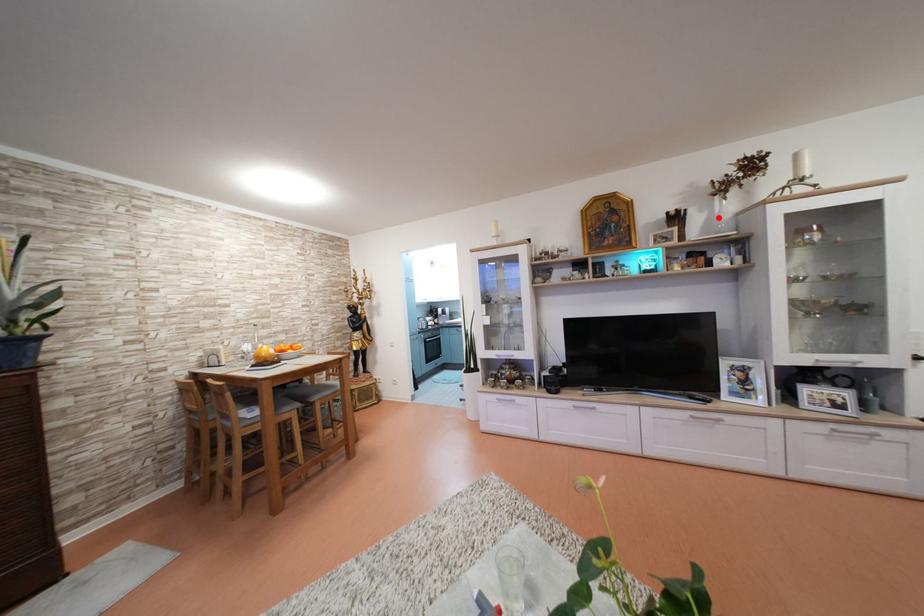
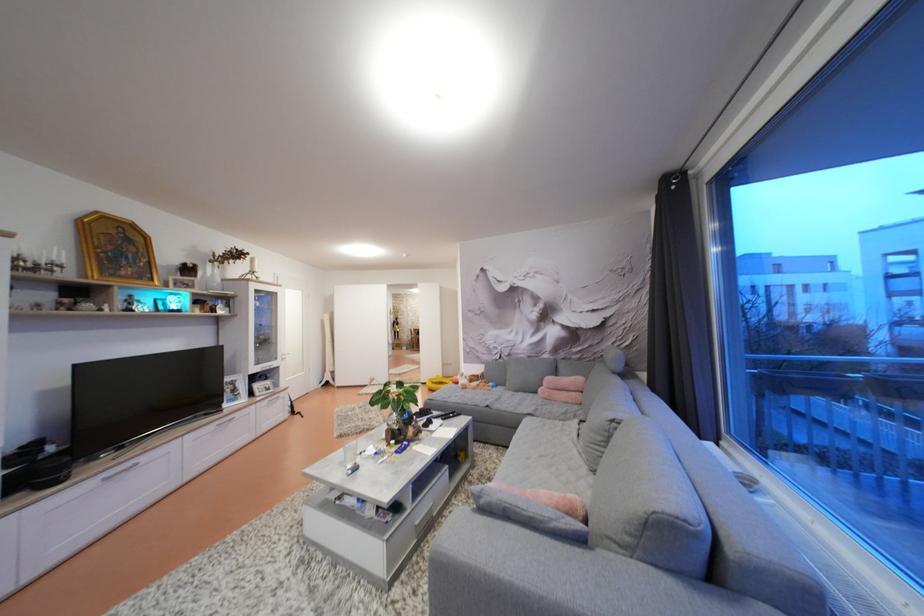
In the second image, find the point that corresponds to the highlighted location in the first image.

(213, 278)